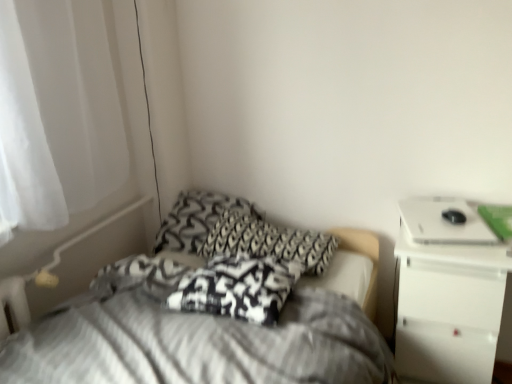
Measure the distance between textured gray bed at center and camera.

The distance of textured gray bed at center from camera is 1.05 meters.

Measure the distance between point (358, 369) and camera.

Point (358, 369) is 3.82 feet away from camera.

What is the approximate width of white sheer curtain at left?

white sheer curtain at left is 8.75 inches in width.

What is the approximate height of black and white patterned pillow at center, which is the second pillow from front to back?

It is 5.62 inches.

Image resolution: width=512 pixels, height=384 pixels. What do you see at coordinates (444, 222) in the screenshot?
I see `white glossy laptop at upper right` at bounding box center [444, 222].

Identify the location of black and white patterned pillow at center, acting as the first pillow starting from the back. (197, 219).

Measure the distance between black and white patterned pillow at center, acting as the first pillow starting from the back, and camera.

black and white patterned pillow at center, acting as the first pillow starting from the back, is 1.83 meters from camera.

Find the location of a particular element. textured gray bed at center is located at coordinates (193, 338).

From the image's perspective, is white sheer curtain at left below white glossy nightstand at upper right?

No.

Which is in front, point (11, 96) or point (458, 329)?

The point (11, 96) is closer.

Considering the sizes of white sheer curtain at left and white glossy nightstand at upper right in the image, is white sheer curtain at left taller or shorter than white glossy nightstand at upper right?

In the image, white sheer curtain at left appears to be taller than white glossy nightstand at upper right.

Does white glossy laptop at upper right turn towards textured gray bed at center?

No, white glossy laptop at upper right does not turn towards textured gray bed at center.

Visually, is white glossy laptop at upper right positioned to the left or to the right of textured gray bed at center?

white glossy laptop at upper right is to the right of textured gray bed at center.

In the scene shown: Is white glossy laptop at upper right closer to camera compared to textured gray bed at center?

No, white glossy laptop at upper right is behind textured gray bed at center.

The image size is (512, 384). I want to click on bed on the left of white glossy laptop at upper right, so click(x=193, y=338).

Can you confirm if textured gray bed at center is taller than white sheer curtain at left?

In fact, textured gray bed at center may be shorter than white sheer curtain at left.

Is point (87, 364) positioned before point (25, 177)?

That is True.

In the scene shown: From a real-world perspective, is textured gray bed at center physically above white sheer curtain at left?

Incorrect, from a real-world perspective, textured gray bed at center is lower than white sheer curtain at left.

Does textured gray bed at center have a greater width compared to white sheer curtain at left?

Indeed, textured gray bed at center has a greater width compared to white sheer curtain at left.

From a real-world perspective, is white glossy laptop at upper right above or below white sheer curtain at left?

Clearly, from a real-world perspective, white glossy laptop at upper right is below white sheer curtain at left.

Measure the distance between white glossy laptop at upper right and white sheer curtain at left.

white glossy laptop at upper right is 4.17 feet away from white sheer curtain at left.

Can you tell me how much white glossy laptop at upper right and white sheer curtain at left differ in facing direction?

white glossy laptop at upper right and white sheer curtain at left are facing 74.5 degrees away from each other.

Considering the relative sizes of white glossy laptop at upper right and white sheer curtain at left in the image provided, is white glossy laptop at upper right taller than white sheer curtain at left?

In fact, white glossy laptop at upper right may be shorter than white sheer curtain at left.

Is textured gray bed at center looking in the opposite direction of white glossy laptop at upper right?

textured gray bed at center does not have its back to white glossy laptop at upper right.

In the scene shown: What's the angular difference between textured gray bed at center and white glossy laptop at upper right's facing directions?

The angular difference between textured gray bed at center and white glossy laptop at upper right is 75.3 degrees.

From the image's perspective, is textured gray bed at center below white glossy laptop at upper right?

Indeed, from the image's perspective, textured gray bed at center is shown beneath white glossy laptop at upper right.

Is black and white patterned pillow at center, which ranks as the 2th pillow in back-to-front order, far away from textured gray bed at center?

That's not correct — black and white patterned pillow at center, which ranks as the 2th pillow in back-to-front order, is a little close to textured gray bed at center.

Which is behind, black and white patterned pillow at center, which is the second pillow from front to back, or textured gray bed at center?

black and white patterned pillow at center, which is the second pillow from front to back, is further from the camera.

Which is correct: black and white patterned pillow at center, which is the second pillow from front to back, is inside textured gray bed at center, or outside of it?

black and white patterned pillow at center, which is the second pillow from front to back, cannot be found inside textured gray bed at center.

Which is closer to the camera, (316,267) or (334,318)?

The point (334,318) is in front.

Which of these two, black and white patterned pillow at center, the 1th pillow from the front, or white glossy laptop at upper right, is smaller?

white glossy laptop at upper right.

From a real-world perspective, is black and white patterned pillow at center, marked as the third pillow in a back-to-front arrangement, located higher than white glossy laptop at upper right?

Incorrect, from a real-world perspective, black and white patterned pillow at center, marked as the third pillow in a back-to-front arrangement, is lower than white glossy laptop at upper right.

Which is more to the right, black and white patterned pillow at center, marked as the third pillow in a back-to-front arrangement, or white glossy laptop at upper right?

From the viewer's perspective, white glossy laptop at upper right appears more on the right side.

Locate an element on the screen. curtain in front of the white glossy nightstand at upper right is located at coordinates coord(56,113).

Locate an element on the screen. Image resolution: width=512 pixels, height=384 pixels. laptop that appears above the textured gray bed at center (from a real-world perspective) is located at coordinates (444, 222).

Which object lies further to the anchor point white glossy nightstand at upper right, black and white patterned pillow at center, which is the third pillow from front to back, or black and white patterned pillow at center, the 1th pillow from the front?

Based on the image, black and white patterned pillow at center, which is the third pillow from front to back, appears to be further to white glossy nightstand at upper right.

Estimate the real-world distances between objects in this image. Which object is further from textured gray bed at center, white glossy nightstand at upper right or black and white patterned pillow at center, which is the second pillow from front to back?

white glossy nightstand at upper right is further to textured gray bed at center.

Estimate the real-world distances between objects in this image. Which object is closer to textured gray bed at center, white glossy nightstand at upper right or white sheer curtain at left?

The object closer to textured gray bed at center is white glossy nightstand at upper right.

When comparing their distances from white glossy laptop at upper right, does white sheer curtain at left or black and white patterned pillow at center, acting as the first pillow starting from the back, seem further?

white sheer curtain at left.

Which object lies further to the anchor point textured gray bed at center, black and white patterned pillow at center, acting as the first pillow starting from the back, or black and white patterned pillow at center, which ranks as the 2th pillow in back-to-front order?

Based on the image, black and white patterned pillow at center, acting as the first pillow starting from the back, appears to be further to textured gray bed at center.

Looking at the image, which one is located further to black and white patterned pillow at center, marked as the third pillow in a back-to-front arrangement, white sheer curtain at left or black and white patterned pillow at center, which ranks as the 2th pillow in back-to-front order?

The object further to black and white patterned pillow at center, marked as the third pillow in a back-to-front arrangement, is white sheer curtain at left.

Estimate the real-world distances between objects in this image. Which object is closer to black and white patterned pillow at center, which is the second pillow from front to back, white glossy laptop at upper right or black and white patterned pillow at center, which is the third pillow from front to back?

black and white patterned pillow at center, which is the third pillow from front to back.

Based on their spatial positions, is black and white patterned pillow at center, which is the second pillow from front to back, or black and white patterned pillow at center, which is the third pillow from front to back, closer to white sheer curtain at left?

Among the two, black and white patterned pillow at center, which is the third pillow from front to back, is located nearer to white sheer curtain at left.

Find the location of a particular element. Image resolution: width=512 pixels, height=384 pixels. laptop located between black and white patterned pillow at center, acting as the first pillow starting from the back, and white glossy nightstand at upper right in the left-right direction is located at coordinates (444, 222).

Locate an element on the screen. The height and width of the screenshot is (384, 512). laptop situated between black and white patterned pillow at center, which is the second pillow from front to back, and white glossy nightstand at upper right from left to right is located at coordinates (444, 222).

The width and height of the screenshot is (512, 384). Identify the location of pillow between black and white patterned pillow at center, marked as the third pillow in a back-to-front arrangement, and black and white patterned pillow at center, acting as the first pillow starting from the back, in the front-back direction. (268, 242).

Identify the location of laptop between white sheer curtain at left and white glossy nightstand at upper right. The height and width of the screenshot is (384, 512). (444, 222).